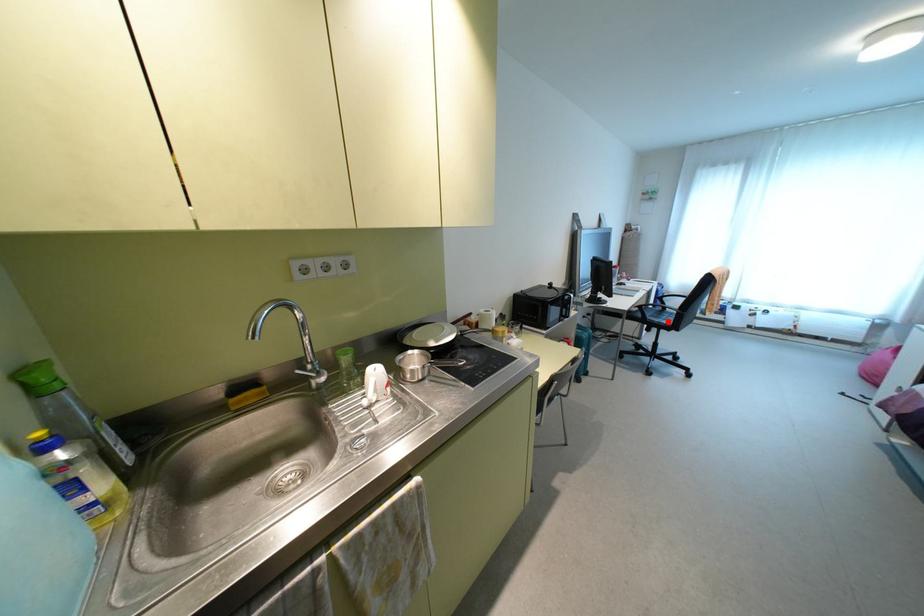
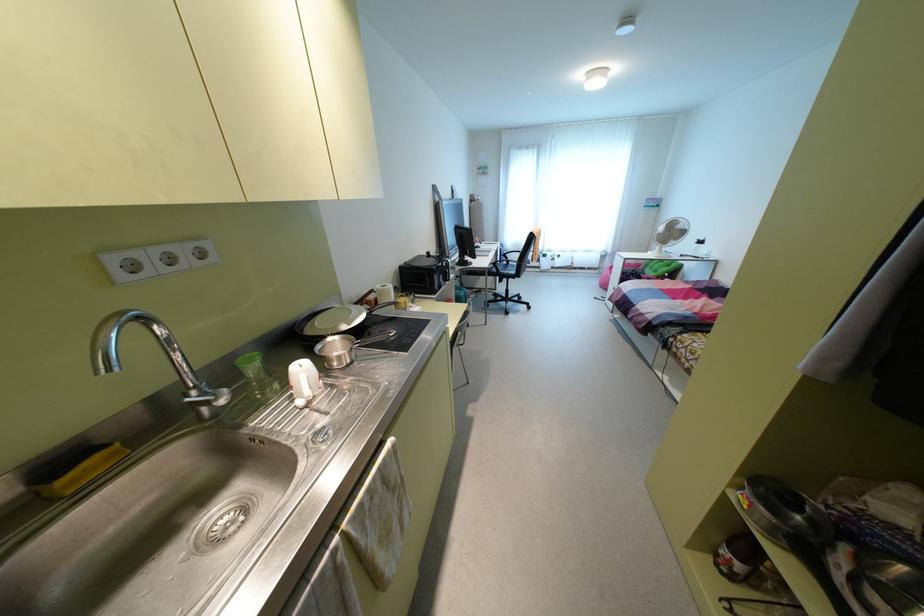
Where in the second image is the point corresponding to the highlighted location from the first image?

(513, 272)